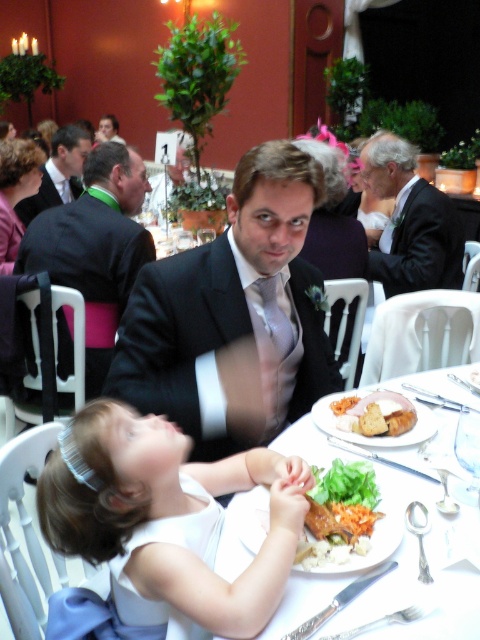
Measure the distance between matte black suit at upper right and camera.

8.40 feet

Who is lower down, matte black suit at upper right or matte black dress at upper center?

Positioned lower is matte black suit at upper right.

Is point (418, 289) closer to camera compared to point (96, 132)?

That is True.

Image resolution: width=480 pixels, height=640 pixels. I want to click on matte black suit at upper right, so click(x=410, y=221).

Who is positioned more to the right, white porcelain plate at center or matte black suit at upper center?

white porcelain plate at center

Which is more to the left, white porcelain plate at center or matte black suit at upper center?

matte black suit at upper center is more to the left.

Where is `white porcelain plate at center`? white porcelain plate at center is located at coordinates (417, 568).

In the scene shown: Is satin black suit at center above matte black suit at center?

Actually, satin black suit at center is below matte black suit at center.

Between satin black suit at center and matte black suit at center, which one has less height?

satin black suit at center is shorter.

Is point (252, 314) farther from viewer compared to point (68, 243)?

No, it is not.

Where is `satin black suit at center`? Image resolution: width=480 pixels, height=640 pixels. satin black suit at center is located at coordinates (233, 316).